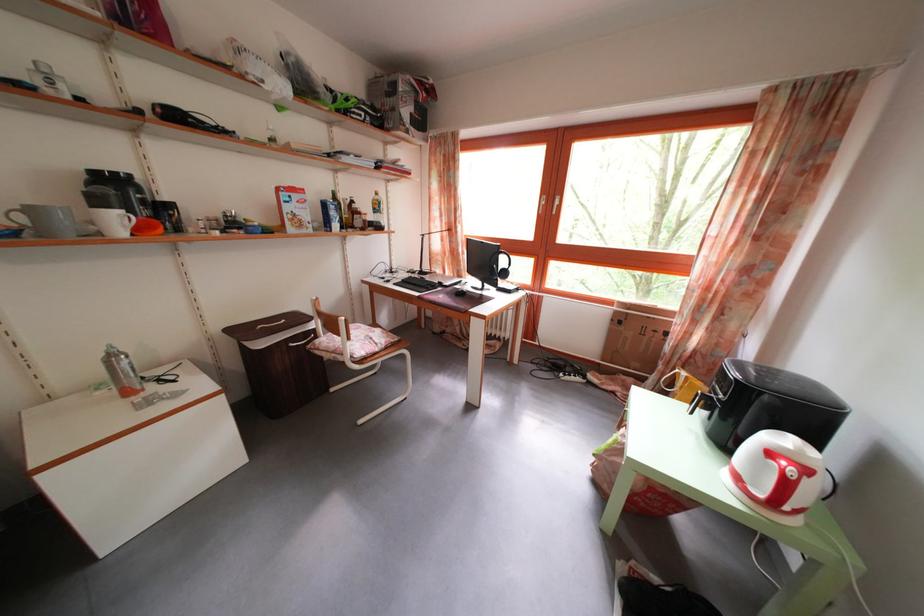
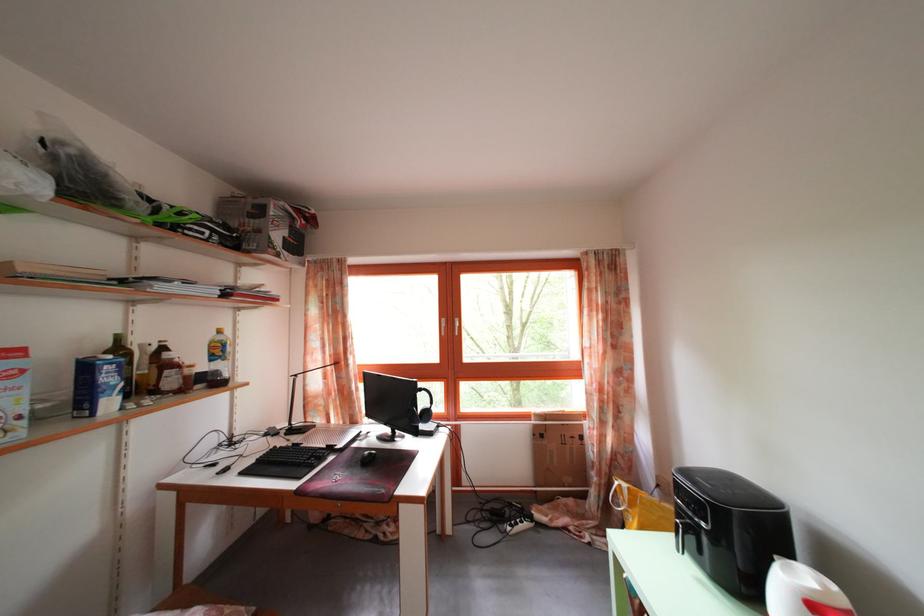
In the second image, find the point that corresponds to [623,320] in the first image.

(542, 432)